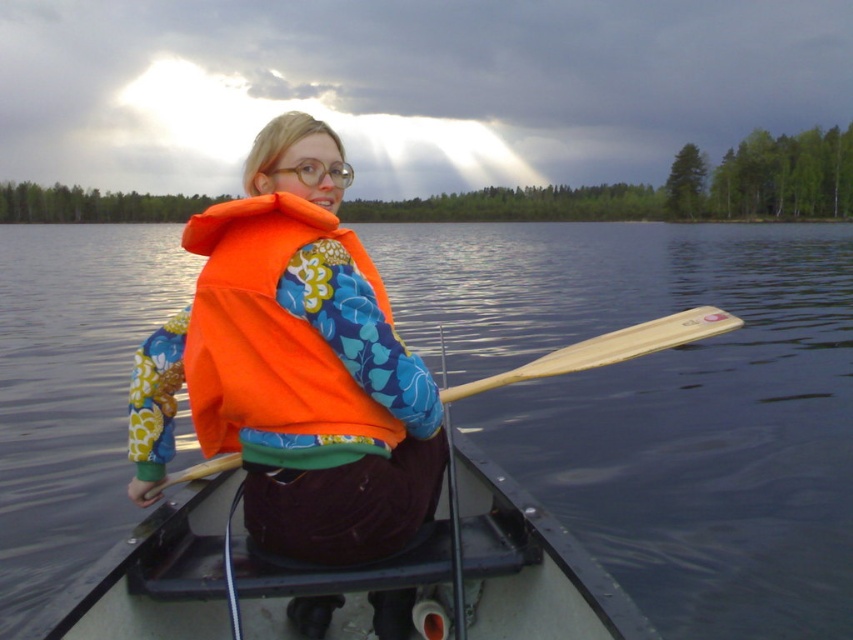
Question: Is orange fabric life vest at center to the left of black plastic boat at center from the viewer's perspective?

Choices:
 (A) yes
 (B) no

Answer: (A)

Question: Which object appears farthest from the camera in this image?

Choices:
 (A) orange fleece life jacket at center
 (B) black plastic boat at center
 (C) wooden paddle at center
 (D) transparent water at center

Answer: (C)

Question: Can you confirm if orange fleece life jacket at center is thinner than wooden paddle at center?

Choices:
 (A) yes
 (B) no

Answer: (A)

Question: Among these points, which one is nearest to the camera?

Choices:
 (A) (263, 422)
 (B) (576, 355)
 (C) (204, 360)
 (D) (126, 573)

Answer: (A)

Question: Can you confirm if orange fabric life vest at center is thinner than wooden paddle at center?

Choices:
 (A) yes
 (B) no

Answer: (A)

Question: Which point appears farthest from the camera in this image?

Choices:
 (A) (119, 531)
 (B) (450, 387)

Answer: (B)